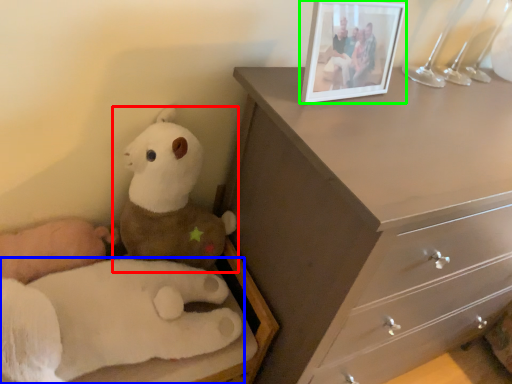
Question: Estimate the real-world distances between objects in this image. Which object is closer to toy (highlighted by a red box), toy (highlighted by a blue box) or picture frame (highlighted by a green box)?

Choices:
 (A) toy
 (B) picture frame

Answer: (A)